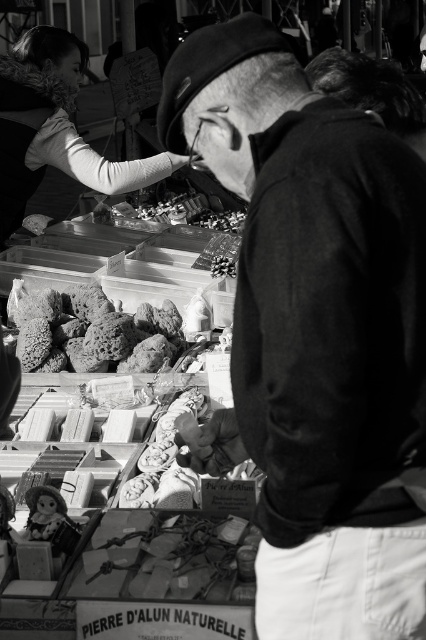
Question: Which is farther from the matte plastic doll at lower left?

Choices:
 (A) rough stone at center
 (B) matte black jacket at center

Answer: (A)

Question: Is rough stone at center positioned at the back of matte plastic doll at lower left?

Choices:
 (A) no
 (B) yes

Answer: (B)

Question: Among these objects, which one is nearest to the camera?

Choices:
 (A) rough stone at center
 (B) matte black jacket at center

Answer: (B)

Question: Observing the image, what is the correct spatial positioning of rough stone at center in reference to matte plastic doll at lower left?

Choices:
 (A) below
 (B) above

Answer: (B)

Question: Is matte black jacket at center positioned in front of rough stone at center?

Choices:
 (A) no
 (B) yes

Answer: (B)

Question: Among these points, which one is farthest from the camera?

Choices:
 (A) (51, 314)
 (B) (276, 422)
 (C) (39, 513)

Answer: (A)